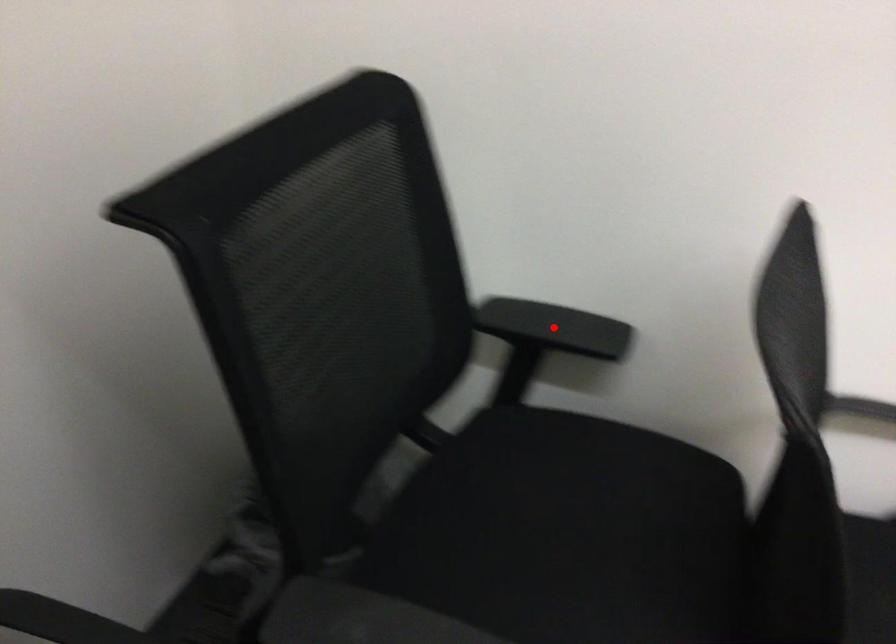
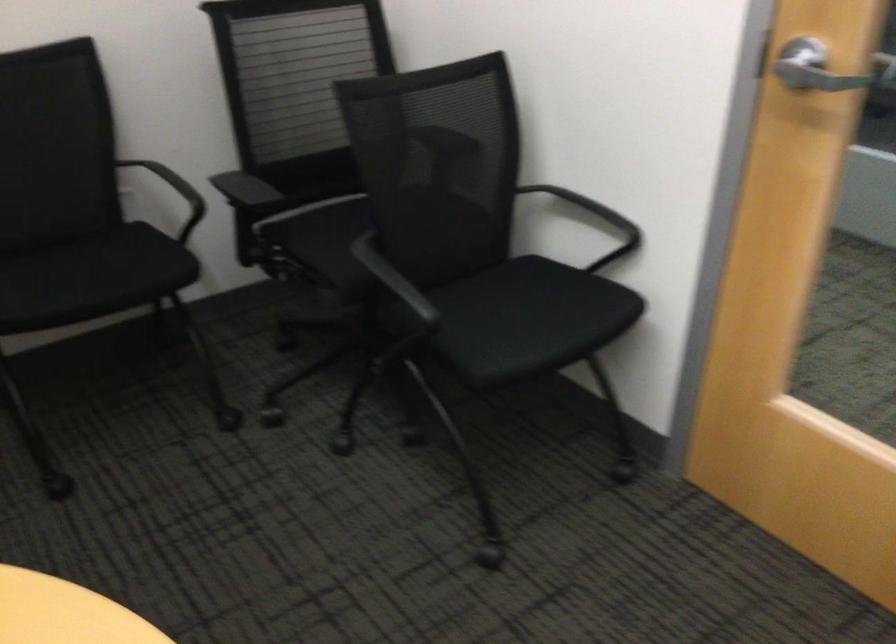
Question: I am providing you with two images of the same scene from different viewpoints. A red point is marked on the first image. Is the red point's position out of view in image 2?

Choices:
 (A) Yes
 (B) No

Answer: (A)